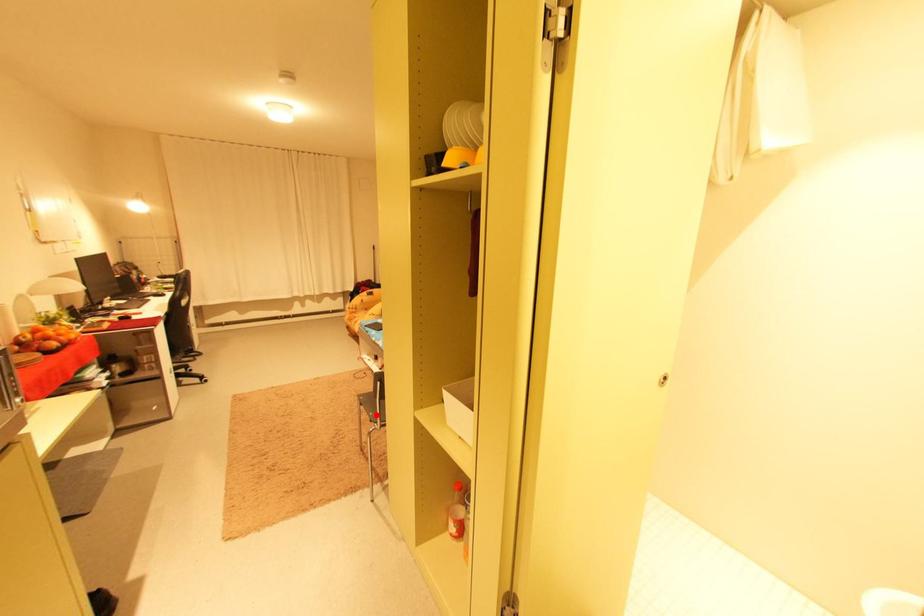
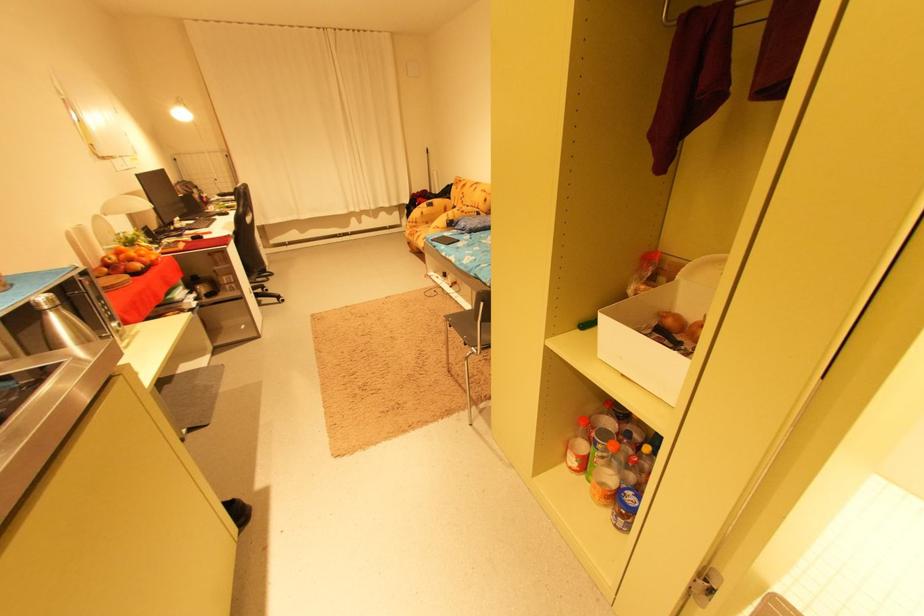
Locate, in the second image, the point that corresponds to the highlighted location in the first image.

(469, 338)